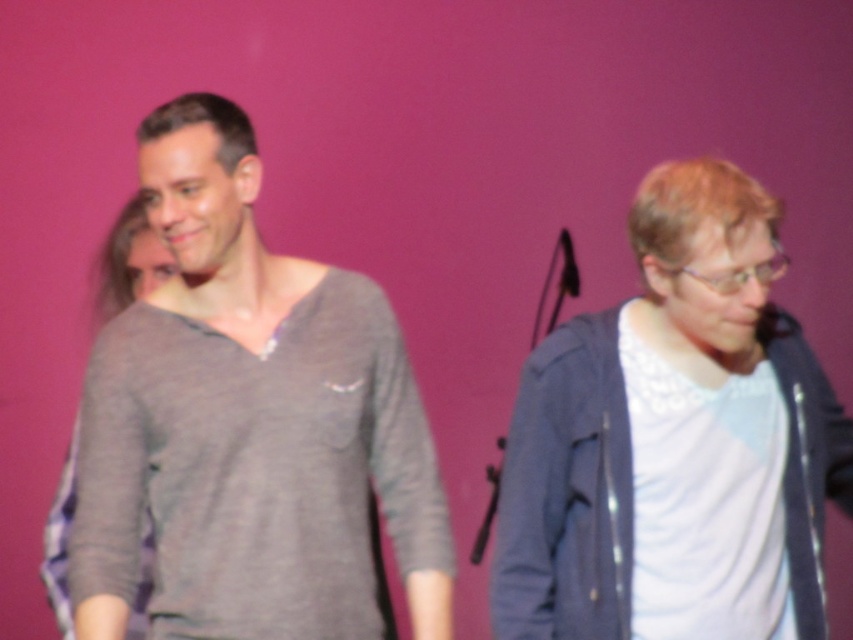
Question: Considering the real-world distances, which object is closest to the matte gray sweater at left?

Choices:
 (A) gray cotton shirt at left
 (B) white matte jacket at right

Answer: (A)

Question: Can you confirm if gray cotton shirt at left is positioned above matte gray sweater at left?

Choices:
 (A) yes
 (B) no

Answer: (B)

Question: Which point is farther to the camera?

Choices:
 (A) (115, 308)
 (B) (181, 362)
 (C) (573, 618)

Answer: (A)

Question: Is gray cotton shirt at left below matte gray sweater at left?

Choices:
 (A) yes
 (B) no

Answer: (A)

Question: Estimate the real-world distances between objects in this image. Which object is closer to the gray cotton shirt at left?

Choices:
 (A) white matte jacket at right
 (B) matte gray sweater at left

Answer: (A)

Question: Does gray cotton shirt at left come in front of white matte jacket at right?

Choices:
 (A) no
 (B) yes

Answer: (B)